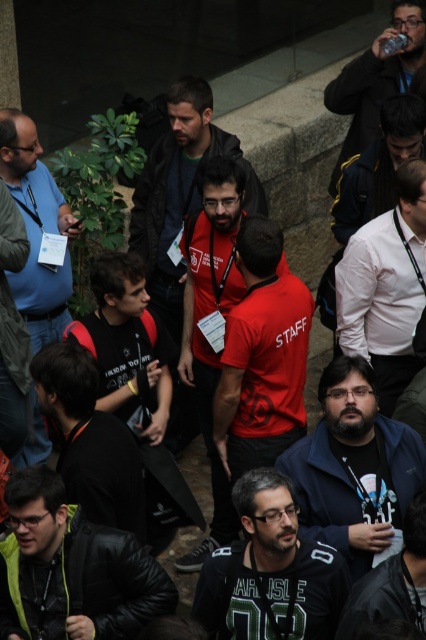
Can you confirm if black leather jacket at lower left is thinner than matte blue shirt at left?

No.

Is point (158, 612) in front of point (46, 256)?

Yes, it is.

Locate an element on the screen. The height and width of the screenshot is (640, 426). black leather jacket at lower left is located at coordinates (71, 570).

Can you confirm if black leather jacket at lower left is thinner than dark gray jersey at center?

No, black leather jacket at lower left is not thinner than dark gray jersey at center.

Is black leather jacket at lower left smaller than dark gray jersey at center?

No.

Does point (34, 554) come in front of point (221, 632)?

Yes, point (34, 554) is in front of point (221, 632).

What are the coordinates of `black leather jacket at lower left` in the screenshot? It's located at (71, 570).

Does point (164, 250) lie in front of point (394, 120)?

No, (164, 250) is further to viewer.

From the picture: Does red matte shirt at center have a lesser width compared to matte black shirt at center?

In fact, red matte shirt at center might be wider than matte black shirt at center.

The height and width of the screenshot is (640, 426). Describe the element at coordinates (180, 192) in the screenshot. I see `red matte shirt at center` at that location.

Identify the location of red matte shirt at center. Image resolution: width=426 pixels, height=640 pixels. (180, 192).